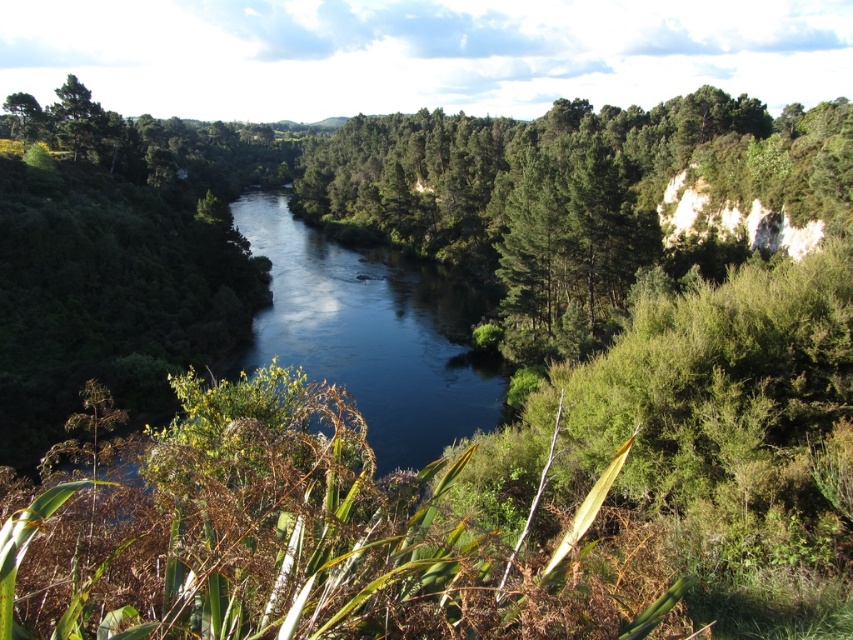
You are standing at the point with coordinates point (x=15, y=93) and want to walk towards the point with coordinates point (x=497, y=371). According to the scene, will you have to go through any obstacles like dense vegetation or the river?

Point (x=497, y=371) is in front of point (x=15, y=93), so you will have to go through the dense vegetation between them to reach your destination.

You are a hiker planning to cross the river using a narrow wooden bridge that is exactly 1.2 meters wide. You notice two green leafy trees in the scene. Which tree, the green leafy tree at center or the green leafy tree at upper left, would you need to avoid if the bridge is too narrow for both? Explain your reasoning based on their sizes.

The green leafy tree at center has a larger size compared to the green leafy tree at upper left. Therefore, to cross the bridge safely, you should avoid the green leafy tree at center since it is bigger and may obstruct the path more than the smaller one at upper left.

You are planning to take a photo of the green leafy tree at center and the dark blue water at center in the scene. Which object occupies a wider area in the image?

The green leafy tree at center has a larger width than the dark blue water at center, so the green leafy tree at center occupies a wider area in the image.